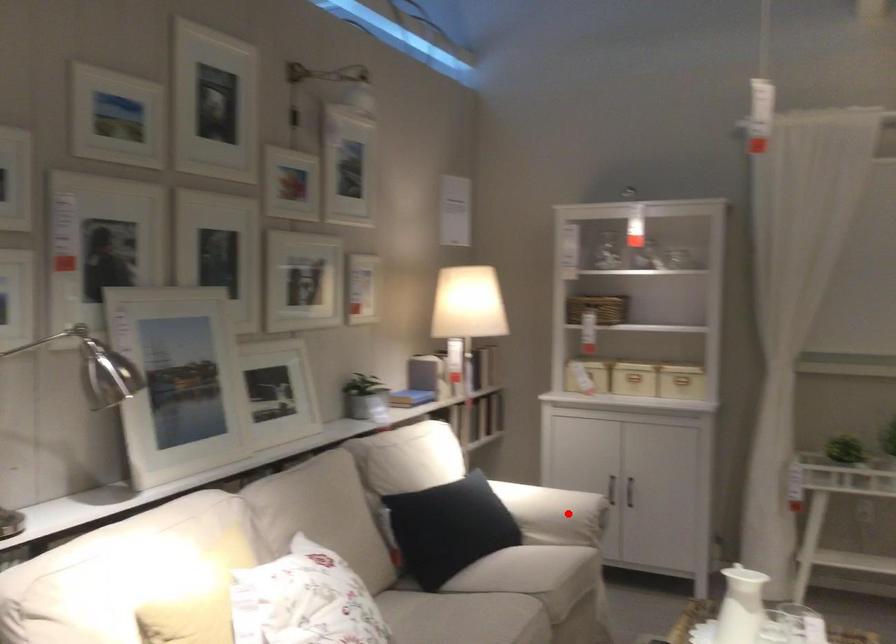
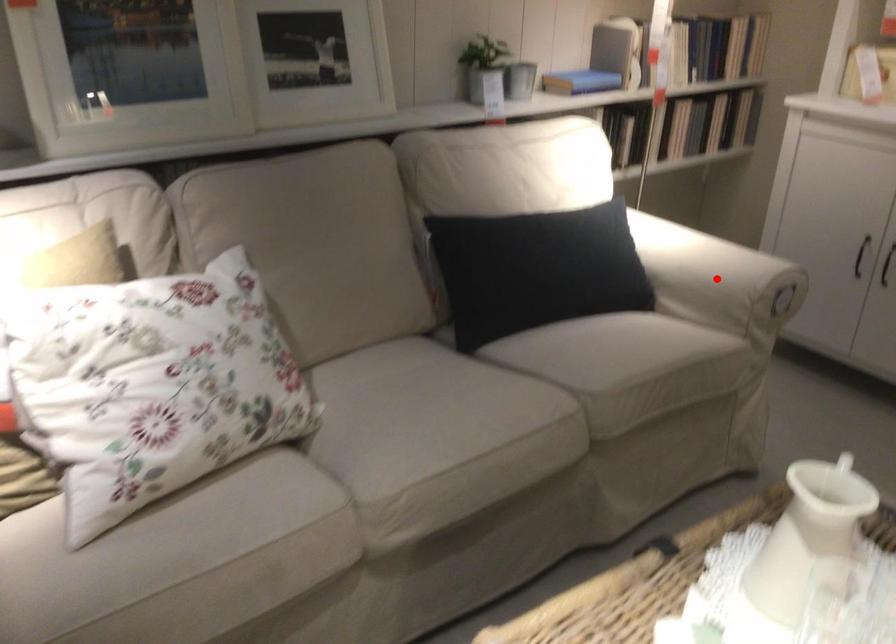
I am providing you with two images of the same scene from different viewpoints. A red point is marked on the first image and another point is marked on the second image. Is the red point in image1 aligned with the point shown in image2?

Yes